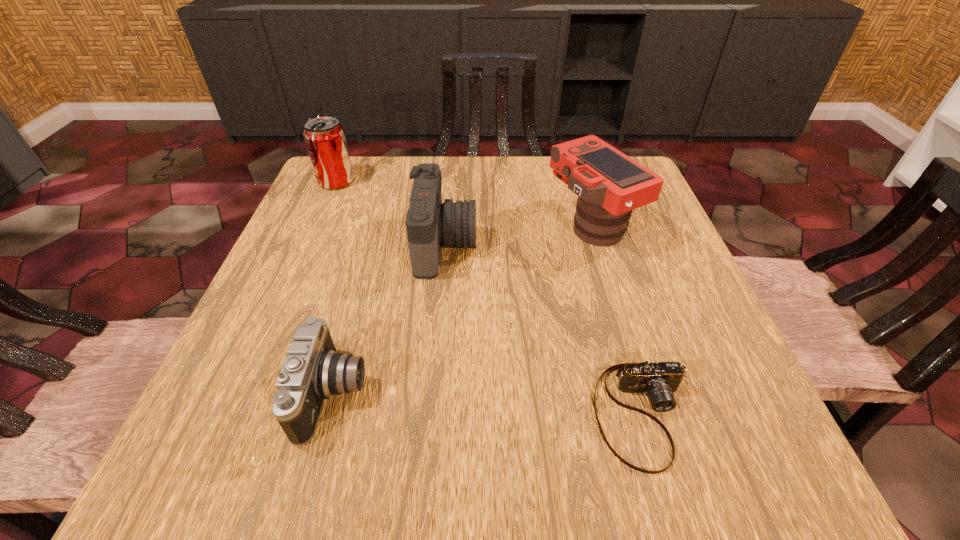
Locate an element on the screen. This screenshot has width=960, height=540. the farthest object is located at coordinates (325, 138).

Locate an element on the screen. This screenshot has height=540, width=960. pop soda is located at coordinates (325, 138).

The width and height of the screenshot is (960, 540). In order to click on the third camera from right to left in this screenshot , I will do `click(429, 223)`.

This screenshot has height=540, width=960. I want to click on the third shortest camera, so click(x=429, y=223).

Find the location of a particular element. the leftmost camera is located at coordinates (312, 371).

What are the coordinates of `the second shortest camera` in the screenshot? It's located at (312, 371).

Locate an element on the screen. This screenshot has height=540, width=960. the shortest camera is located at coordinates (658, 381).

I want to click on vacant region located on the front of the pop soda, so click(308, 247).

Where is `free space located at the lens of the second camera from left to right`? free space located at the lens of the second camera from left to right is located at coordinates (618, 244).

I want to click on blank space located on the front-facing side of the second shortest object, so click(450, 394).